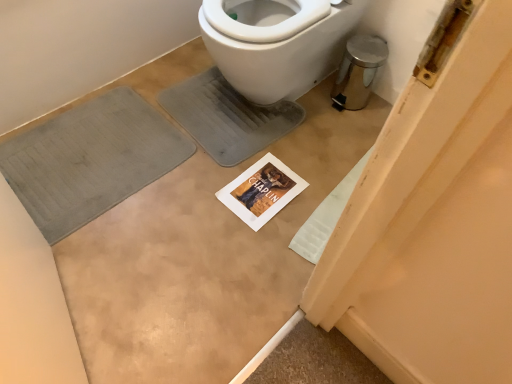
Question: From the image's perspective, is gray fabric bath mat at lower left above or below white plastic bidet at upper center?

Choices:
 (A) above
 (B) below

Answer: (B)

Question: Considering their positions, is gray fabric bath mat at lower left located in front of or behind white plastic bidet at upper center?

Choices:
 (A) behind
 (B) front

Answer: (A)

Question: From a real-world perspective, relative to white plastic bidet at upper center, is gray fabric bath mat at lower left vertically above or below?

Choices:
 (A) below
 (B) above

Answer: (A)

Question: From a real-world perspective, is white plastic bidet at upper center positioned above or below gray fabric bath mat at lower left?

Choices:
 (A) below
 (B) above

Answer: (B)

Question: Is white plastic bidet at upper center bigger or smaller than gray fabric bath mat at lower left?

Choices:
 (A) small
 (B) big

Answer: (B)

Question: Is point (301, 59) closer or farther from the camera than point (119, 168)?

Choices:
 (A) farther
 (B) closer

Answer: (A)

Question: Would you say white plastic bidet at upper center is to the left or to the right of gray fabric bath mat at lower left in the picture?

Choices:
 (A) left
 (B) right

Answer: (B)